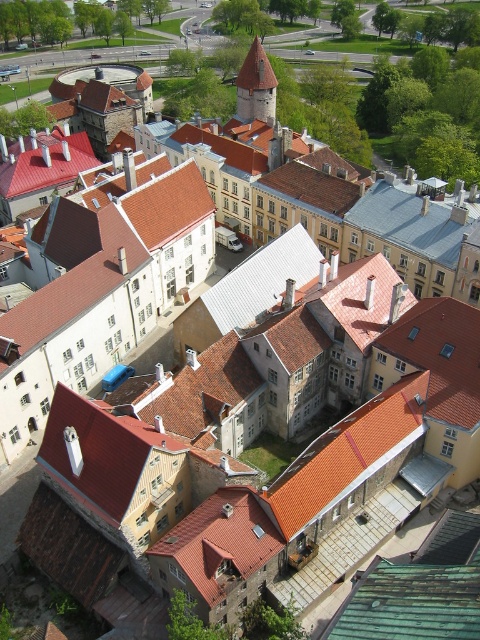
From the picture: Does green shingles at center have a greater width compared to brown stone tower at center?

Yes, green shingles at center is wider than brown stone tower at center.

Is green shingles at center positioned at the back of brown stone tower at center?

That is False.

Between point (474, 582) and point (240, 102), which one is positioned in front?

Point (474, 582)

You are a GUI agent. You are given a task and a screenshot of the screen. Output one action in this format:
    pyautogui.click(x=<x>, y=<y>)
    Task: Click on the green shingles at center
    Image resolution: width=480 pixels, height=640 pixels.
    Given the screenshot: What is the action you would take?
    pyautogui.click(x=409, y=604)

Is orange tile roof at center behind green shingles at center?

That is True.

Which is in front, point (396, 412) or point (421, 625)?

Point (421, 625)

Where is `orange tile roof at center`? The image size is (480, 640). orange tile roof at center is located at coordinates (348, 452).

Can you confirm if orange tile roof at center is positioned to the right of brown stone tower at center?

Yes, orange tile roof at center is to the right of brown stone tower at center.

Is orange tile roof at center thinner than brown stone tower at center?

No.

What do you see at coordinates (348, 452) in the screenshot?
I see `orange tile roof at center` at bounding box center [348, 452].

Where is `orange tile roof at center`? The height and width of the screenshot is (640, 480). orange tile roof at center is located at coordinates (348, 452).